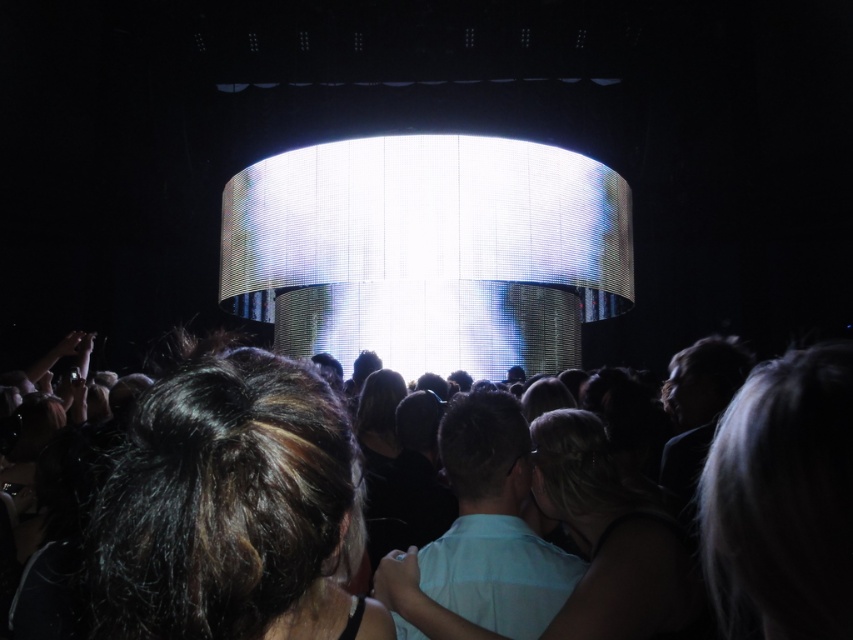
You are a photographer at the concert and want to capture both the dark brown hair at center and the blonde hair at center in a single shot. Which person should you focus on to ensure both are in frame?

You should focus on the dark brown hair at center because it is larger and more prominent, ensuring both it and the smaller blonde hair at center are within the camera frame.